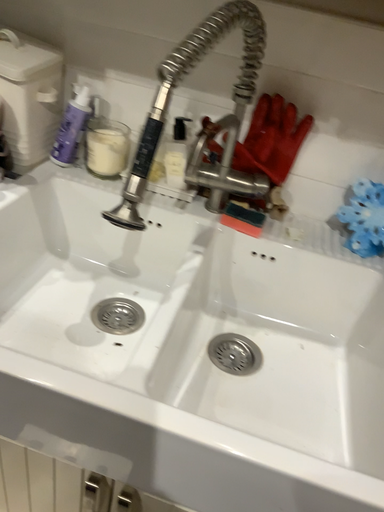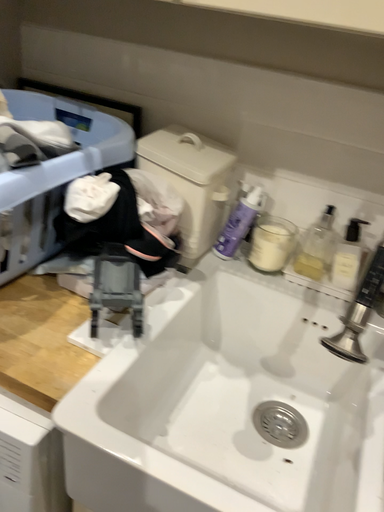
Question: How did the camera likely rotate when shooting the video?

Choices:
 (A) rotated left
 (B) rotated right

Answer: (A)